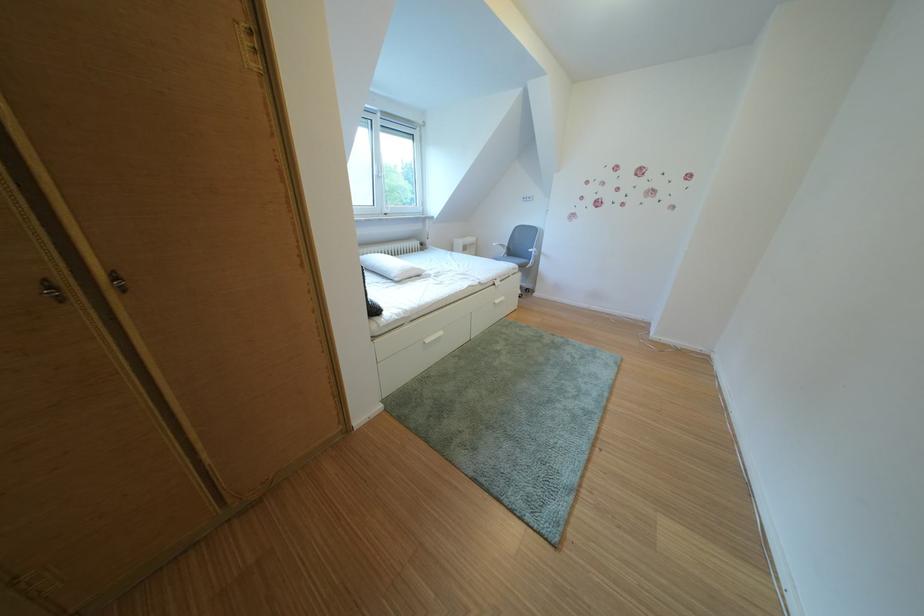
What do you see at coordinates (387, 174) in the screenshot? The width and height of the screenshot is (924, 616). I see `the white window handle` at bounding box center [387, 174].